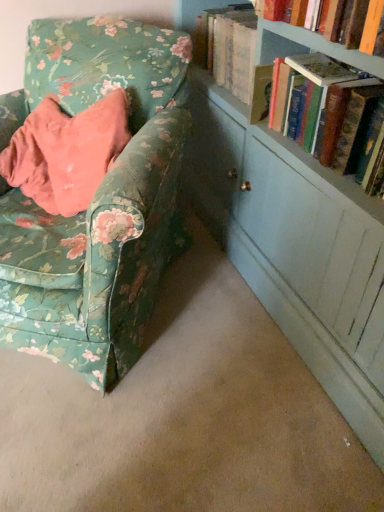
Question: From a real-world perspective, is floral fabric chair at left located beneath hardcover book at upper right?

Choices:
 (A) no
 (B) yes

Answer: (B)

Question: Considering the relative positions of floral fabric chair at left and hardcover book at upper right in the image provided, is floral fabric chair at left to the right of hardcover book at upper right from the viewer's perspective?

Choices:
 (A) yes
 (B) no

Answer: (B)

Question: Is floral fabric chair at left positioned far away from hardcover book at upper right?

Choices:
 (A) no
 (B) yes

Answer: (A)

Question: Is floral fabric chair at left located outside hardcover book at upper right?

Choices:
 (A) yes
 (B) no

Answer: (A)

Question: Can you confirm if floral fabric chair at left is taller than hardcover book at upper right?

Choices:
 (A) no
 (B) yes

Answer: (B)

Question: From the image's perspective, is floral fabric chair at left located beneath hardcover book at upper right?

Choices:
 (A) no
 (B) yes

Answer: (B)

Question: Is hardcover book at upper right next to floral fabric chair at left and touching it?

Choices:
 (A) yes
 (B) no

Answer: (B)

Question: Can you confirm if hardcover book at upper right is thinner than floral fabric chair at left?

Choices:
 (A) no
 (B) yes

Answer: (B)

Question: From a real-world perspective, is hardcover book at upper right located higher than floral fabric chair at left?

Choices:
 (A) yes
 (B) no

Answer: (A)

Question: From a real-world perspective, is hardcover book at upper right below floral fabric chair at left?

Choices:
 (A) yes
 (B) no

Answer: (B)

Question: Is hardcover book at upper right shorter than floral fabric chair at left?

Choices:
 (A) no
 (B) yes

Answer: (B)

Question: From the image's perspective, is hardcover book at upper right located beneath floral fabric chair at left?

Choices:
 (A) yes
 (B) no

Answer: (B)

Question: Choose the correct answer: Is floral fabric chair at left inside hardcover book at upper right or outside it?

Choices:
 (A) outside
 (B) inside

Answer: (A)